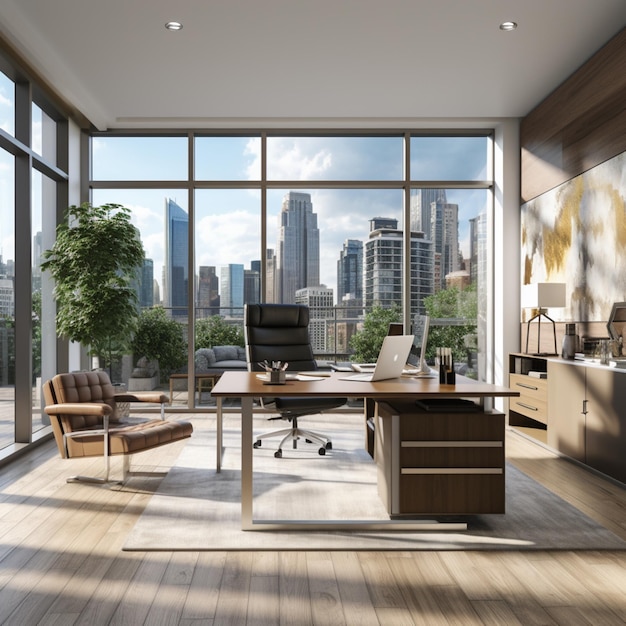
Identify the location of ceiling lights. (509, 26), (175, 28).